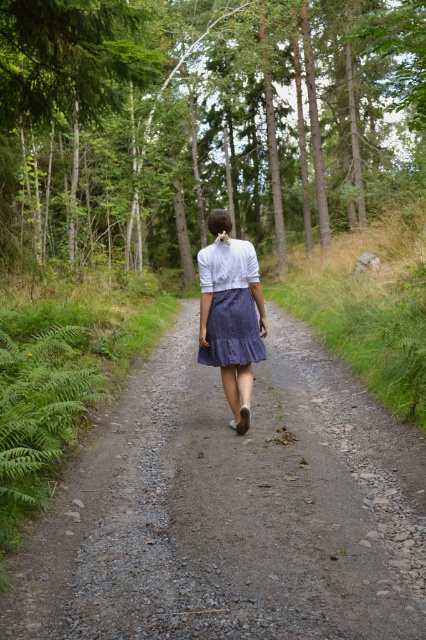
Is green leafy forest at center above dirt path at center?

Indeed, green leafy forest at center is positioned over dirt path at center.

Does green leafy forest at center have a lesser width compared to dirt path at center?

Incorrect, green leafy forest at center's width is not less than dirt path at center's.

Describe the element at coordinates (201, 120) in the screenshot. Image resolution: width=426 pixels, height=640 pixels. I see `green leafy forest at center` at that location.

What are the coordinates of `green leafy forest at center` in the screenshot? It's located at (201, 120).

Which is more to the right, green leafy forest at center or denim skirt at center?

green leafy forest at center is more to the right.

Describe the element at coordinates (201, 120) in the screenshot. This screenshot has height=640, width=426. I see `green leafy forest at center` at that location.

Between point (322, 10) and point (213, 362), which one is positioned behind?

Positioned behind is point (322, 10).

You are a GUI agent. You are given a task and a screenshot of the screen. Output one action in this format:
    pyautogui.click(x=<x>, y=<y>)
    Task: Click on the green leafy forest at center
    
    Given the screenshot: What is the action you would take?
    pyautogui.click(x=201, y=120)

Between dirt path at center and denim skirt at center, which one has less height?

dirt path at center is shorter.

This screenshot has width=426, height=640. What do you see at coordinates (230, 509) in the screenshot?
I see `dirt path at center` at bounding box center [230, 509].

Where is `dirt path at center`? The height and width of the screenshot is (640, 426). dirt path at center is located at coordinates (230, 509).